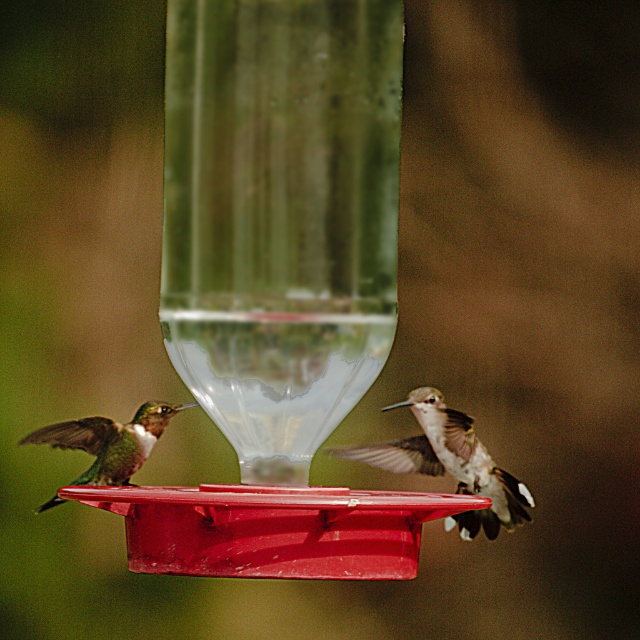
You are a photographer aiming to capture a clear photo of both the matte plastic bird feeder at center and the white iridescent feathers at right. Since you want both subjects in focus, which one should you adjust your camera focus to prioritize?

You should prioritize focusing on the matte plastic bird feeder at center because it is closer to the viewer than the white iridescent feathers at right. In photography, focusing on the closer object ensures that it remains sharp, and the farther object may still be in acceptable focus depending on the depth of field.

You are a birdwatcher observing the two hummingbirds at the feeder. Which hummingbird, the white iridescent feathers at right or the shiny green hummingbird at left, has a wider body?

The white iridescent feathers at right might be wider than the shiny green hummingbird at left.

You are a birdwatcher observing two hummingbirds at a feeder. You notice the white iridescent feathers at right and the shiny green hummingbird at left. Which of the two has a larger size?

The white iridescent feathers at right is larger in size than the shiny green hummingbird at left.